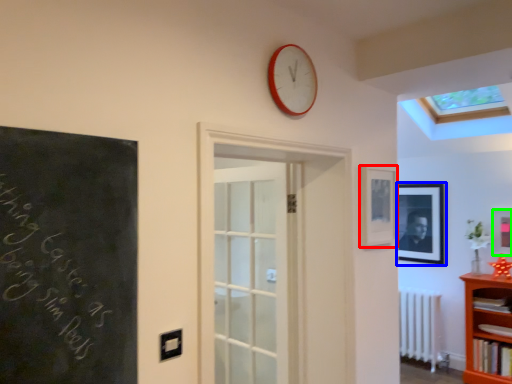
Question: Considering the real-world distances, which object is closest to picture frame (highlighted by a red box)? picture frame (highlighted by a blue box) or picture frame (highlighted by a green box).

Choices:
 (A) picture frame
 (B) picture frame

Answer: (B)